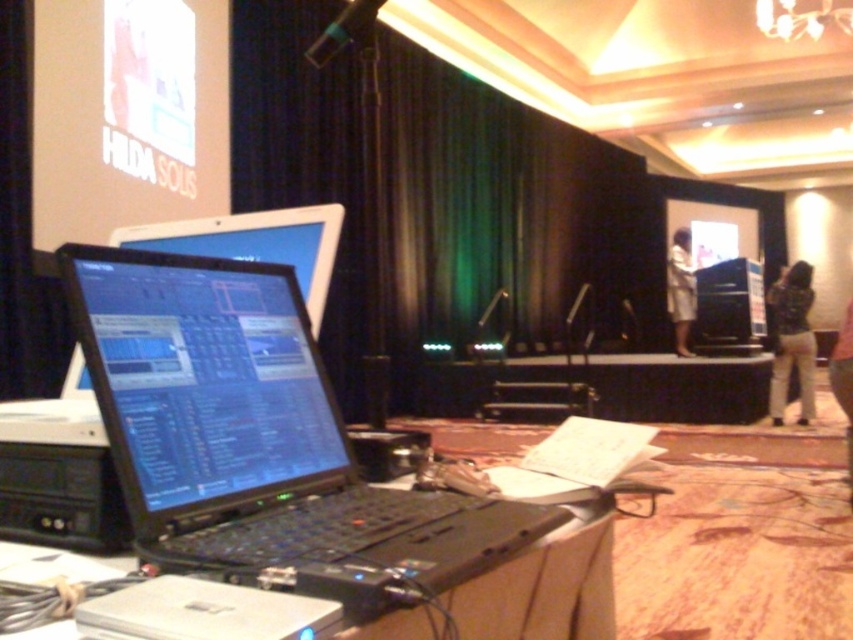
Question: Is white glossy projection screen at upper left positioned in front of tan fabric pants at lower right?

Choices:
 (A) no
 (B) yes

Answer: (B)

Question: Does white glossy projection screen at upper left have a greater width compared to light brown pants at lower right?

Choices:
 (A) no
 (B) yes

Answer: (B)

Question: Which object is closer to the camera taking this photo?

Choices:
 (A) black plastic table at lower left
 (B) white fabric at center
 (C) black plastic laptop at center
 (D) black fabric curtain at center

Answer: (A)

Question: Can you confirm if black fabric curtain at center is thinner than white glossy projection screen at upper left?

Choices:
 (A) yes
 (B) no

Answer: (A)

Question: Which point is farther from the camera taking this photo?

Choices:
 (A) (782, 420)
 (B) (683, 285)
 (C) (849, 316)

Answer: (B)

Question: Based on their relative distances, which object is nearer to the white fabric at center?

Choices:
 (A) tan fabric pants at lower right
 (B) black plastic laptop at center
 (C) black plastic table at lower left

Answer: (A)